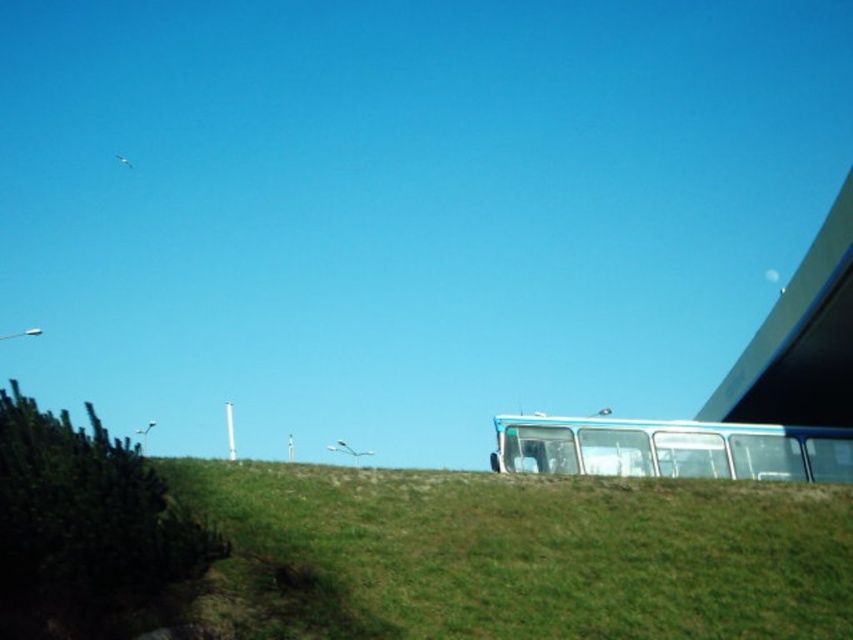
Question: Which object is positioned closest to the smooth concrete overpass at upper right?

Choices:
 (A) blue metallic bus at right
 (B) green grassy hillside at center

Answer: (A)

Question: Is blue metallic bus at right thinner than smooth concrete overpass at upper right?

Choices:
 (A) no
 (B) yes

Answer: (B)

Question: Is green grassy hillside at center thinner than smooth concrete overpass at upper right?

Choices:
 (A) yes
 (B) no

Answer: (A)

Question: Can you confirm if blue metallic bus at right is wider than smooth concrete overpass at upper right?

Choices:
 (A) no
 (B) yes

Answer: (A)

Question: Which point appears farthest from the camera in this image?

Choices:
 (A) [643, 440]
 (B) [306, 476]

Answer: (A)

Question: Estimate the real-world distances between objects in this image. Which object is farther from the smooth concrete overpass at upper right?

Choices:
 (A) green grassy hillside at center
 (B) blue metallic bus at right

Answer: (A)